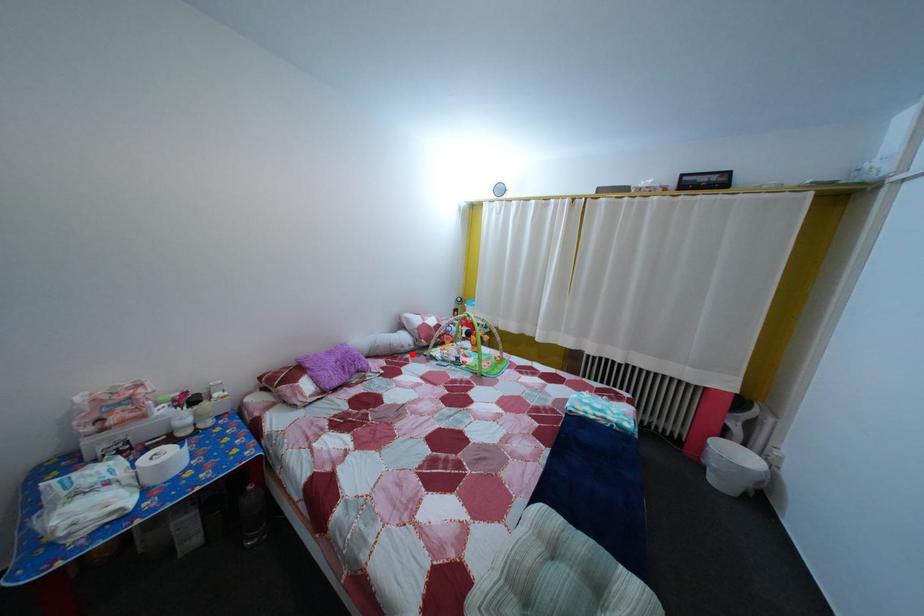
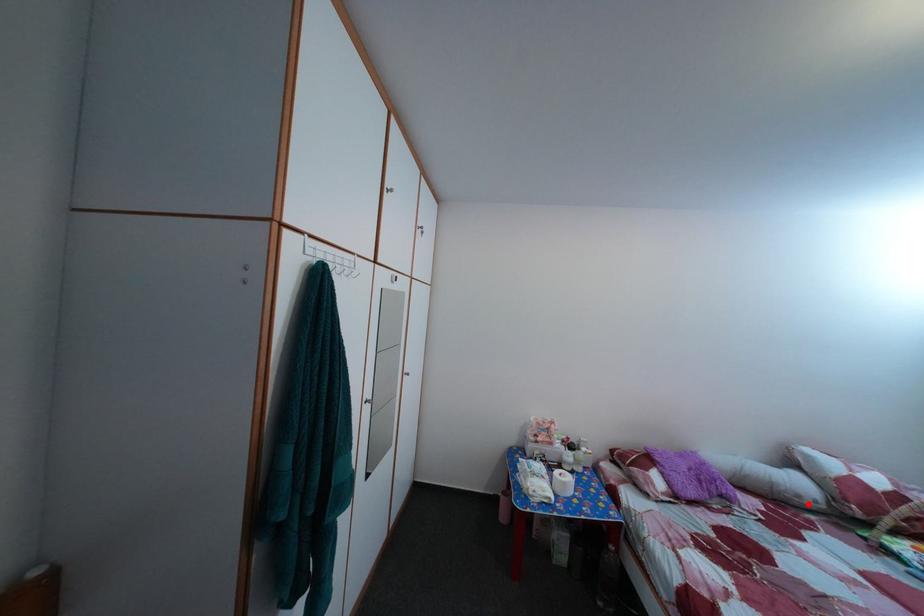
I am providing you with two images of the same scene from different viewpoints. A red point is marked on the first image and another point is marked on the second image. Does the point marked in image1 correspond to the same location as the one in image2?

Yes